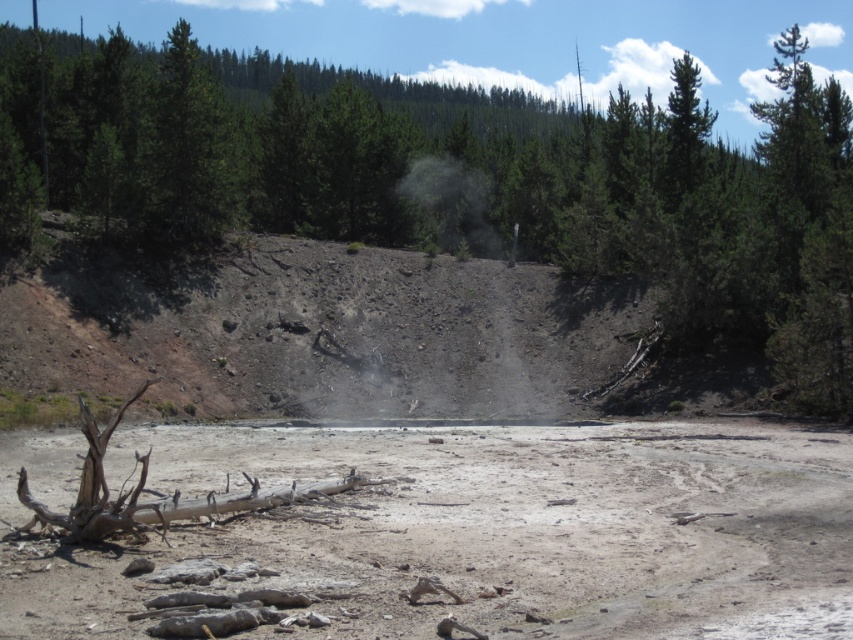
Question: Which of the following is the farthest from the observer?

Choices:
 (A) brown rough log at center
 (B) dull brown dirt at center

Answer: (A)

Question: Is dull brown dirt at center below brown rough log at center?

Choices:
 (A) yes
 (B) no

Answer: (A)

Question: Can you confirm if dull brown dirt at center is positioned to the left of brown rough log at center?

Choices:
 (A) no
 (B) yes

Answer: (A)

Question: Does dull brown dirt at center appear over brown rough log at center?

Choices:
 (A) no
 (B) yes

Answer: (A)

Question: Which point appears farthest from the camera in this image?

Choices:
 (A) (229, 208)
 (B) (485, 560)

Answer: (A)